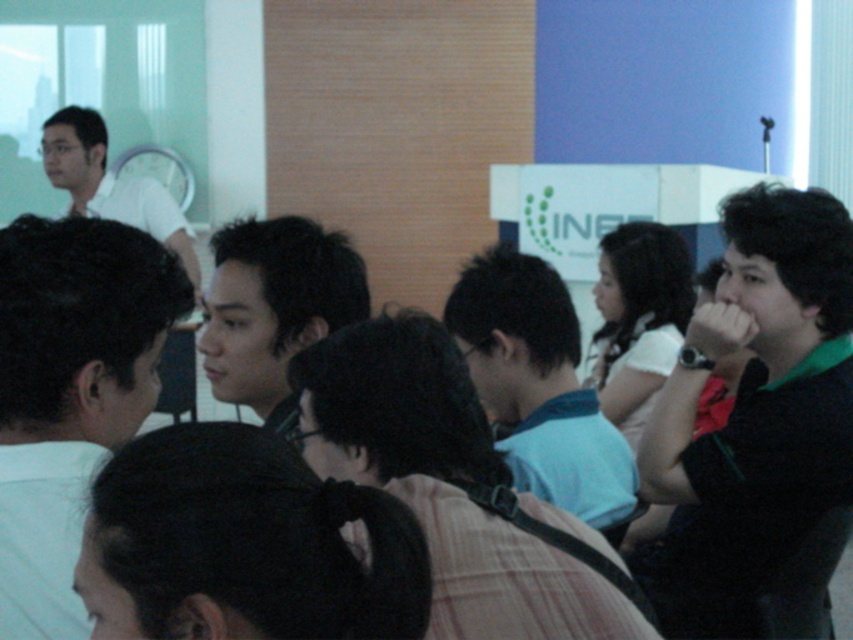
You are sitting at the back of the conference room and want to hand a document to the person wearing the black matte shirt at right and the person with smooth black hair at center. Which person should you approach first based on their proximity to you?

You should approach the black matte shirt at right first because it is closer to you than the smooth black hair at center, which is further away.

You are an event planner arranging seating for a photo. You need to place a name tag on the black matte shirt at right and smooth black hair at center. Which object should you place the name tag closer to the bottom of the person?

You should place the name tag closer to the bottom of the person on the black matte shirt at right because it is located below the smooth black hair at center.

You are an event planner arranging seating for a meeting. You need to place a name tag for the person wearing the black matte shirt at right and the person with smooth black hair at center. Which person should have their name tag placed to the right side of the other?

The black matte shirt at right is positioned on the right side of smooth black hair at center, so the name tag for the person with the smooth black hair at center should be placed to the right side of the person wearing the black matte shirt at right.